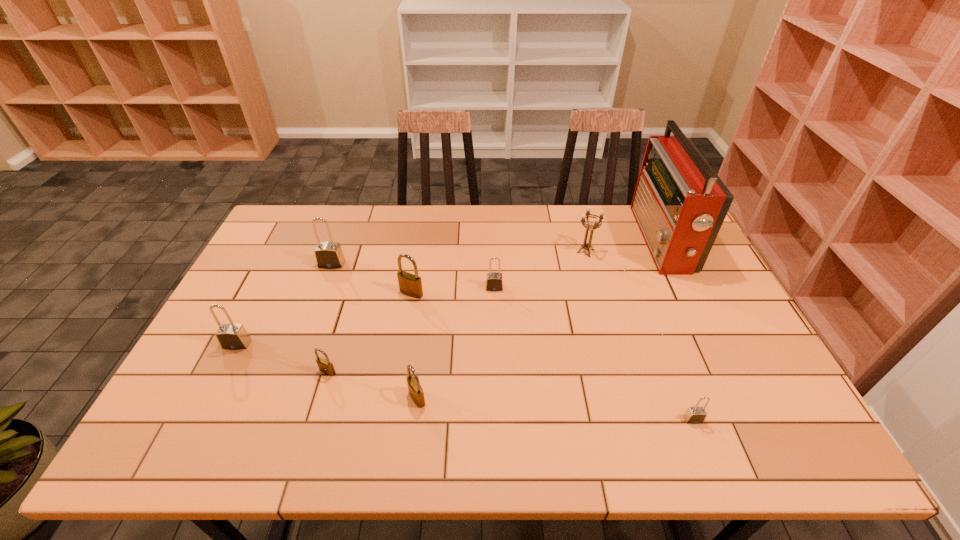
Where is `radio receiver`? The width and height of the screenshot is (960, 540). radio receiver is located at coordinates 679,203.

Find the location of a particular element. The image size is (960, 540). the tallest object is located at coordinates (679, 203).

Locate an element on the screen. The image size is (960, 540). the farthest gray padlock is located at coordinates (329, 255).

Where is `the second object from left to right`? The image size is (960, 540). the second object from left to right is located at coordinates (329, 255).

The width and height of the screenshot is (960, 540). In order to click on candle holder in this screenshot , I will do `click(597, 224)`.

Where is `the farthest brass padlock`? The height and width of the screenshot is (540, 960). the farthest brass padlock is located at coordinates (409, 284).

Find the location of `the second nearest gray padlock`. the second nearest gray padlock is located at coordinates point(231,336).

In order to click on the sixth farthest object in this screenshot , I will do `click(231, 336)`.

You are a GUI agent. You are given a task and a screenshot of the screen. Output one action in this format:
    pyautogui.click(x=<x>, y=<y>)
    Task: Click on the fourth object from right to left
    
    Given the screenshot: What is the action you would take?
    pyautogui.click(x=494, y=282)

Where is `the sixth padlock from left to right`? The width and height of the screenshot is (960, 540). the sixth padlock from left to right is located at coordinates (494, 282).